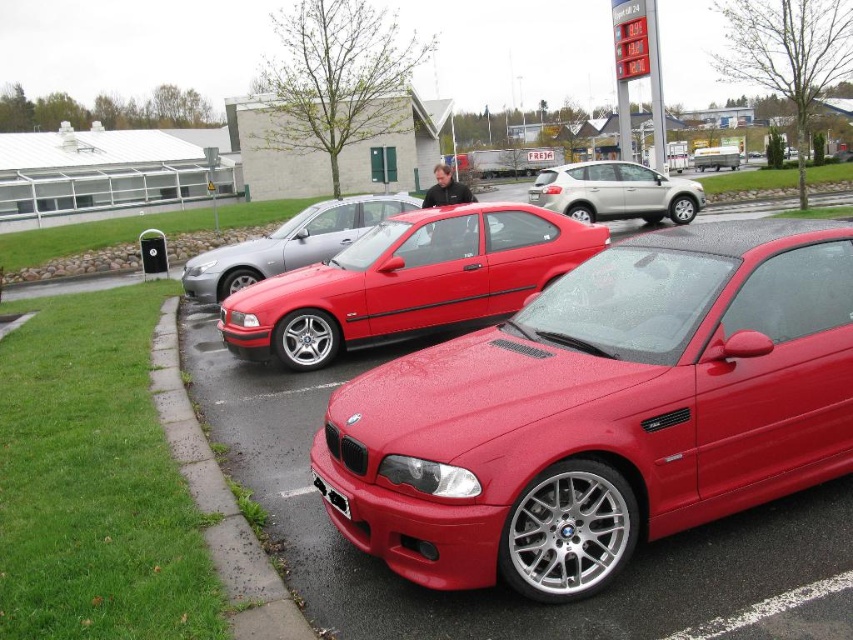
Question: Does shiny red car at center appear on the right side of black plastic license plate at lower center?

Choices:
 (A) no
 (B) yes

Answer: (B)

Question: Which of the following is the farthest from the observer?

Choices:
 (A) (337, 252)
 (B) (492, 273)
 (C) (798, 548)

Answer: (A)

Question: Which object is the farthest from the concrete at lower left?

Choices:
 (A) matte red car at center
 (B) shiny red car at center
 (C) satin silver suv at center

Answer: (C)

Question: Can you confirm if shiny red car at center is bigger than concrete at lower left?

Choices:
 (A) no
 (B) yes

Answer: (B)

Question: Which point is closer to the camera taking this photo?

Choices:
 (A) (194, 273)
 (B) (781, 592)
 (C) (167, 368)
 (D) (625, 180)

Answer: (B)

Question: Does glossy metallic car at center have a lesser width compared to satin silver suv at center?

Choices:
 (A) yes
 (B) no

Answer: (B)